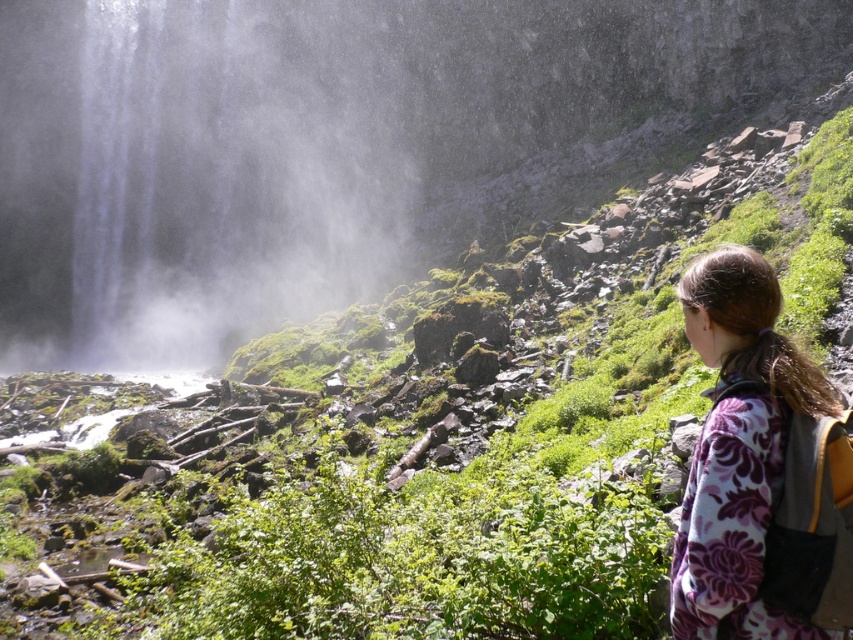
Question: Is white misty waterfall at upper left wider than floral fleece jacket at lower right?

Choices:
 (A) yes
 (B) no

Answer: (A)

Question: Which object appears farthest from the camera in this image?

Choices:
 (A) white misty waterfall at upper left
 (B) floral fleece jacket at lower right

Answer: (A)

Question: Is the position of white misty waterfall at upper left less distant than that of floral fleece jacket at lower right?

Choices:
 (A) yes
 (B) no

Answer: (B)

Question: Is white misty waterfall at upper left above floral fleece jacket at lower right?

Choices:
 (A) no
 (B) yes

Answer: (B)